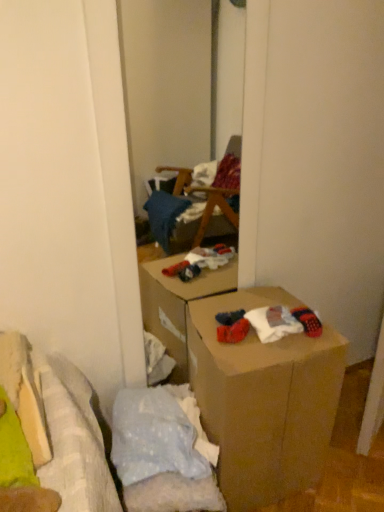
At what (x,y) coordinates should I click in order to perform the action: click on free space above brown cardboard box at center (from a real-world perspective). Please return your answer as a coordinate pair (x, y). Looking at the image, I should click on (264, 324).